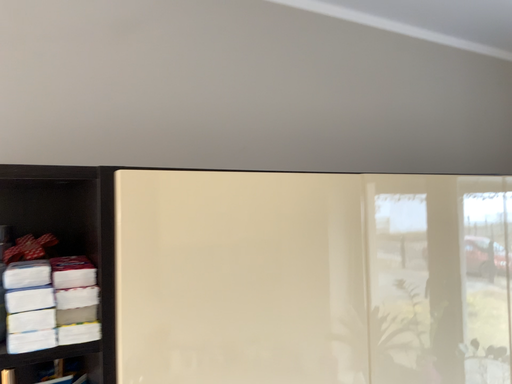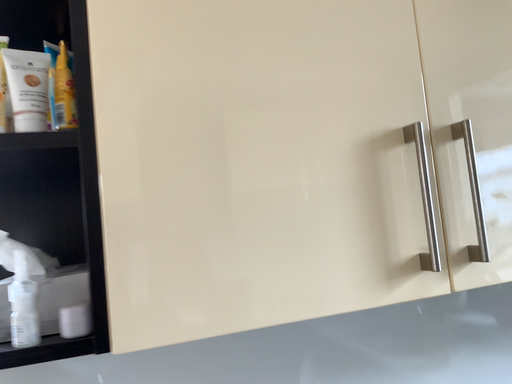
Question: How did the camera likely rotate when shooting the video?

Choices:
 (A) rotated right
 (B) rotated left

Answer: (B)